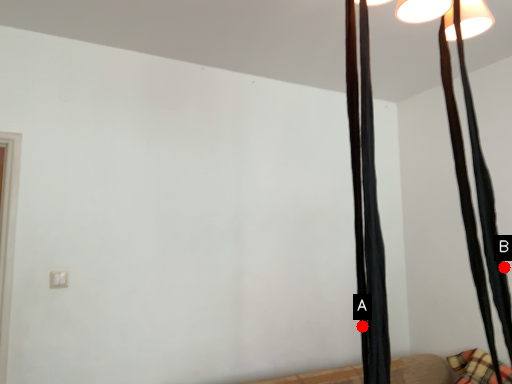
Question: Two points are circled on the image, labeled by A and B beside each circle. Which point is closer to the camera?

Choices:
 (A) A is closer
 (B) B is closer

Answer: (A)